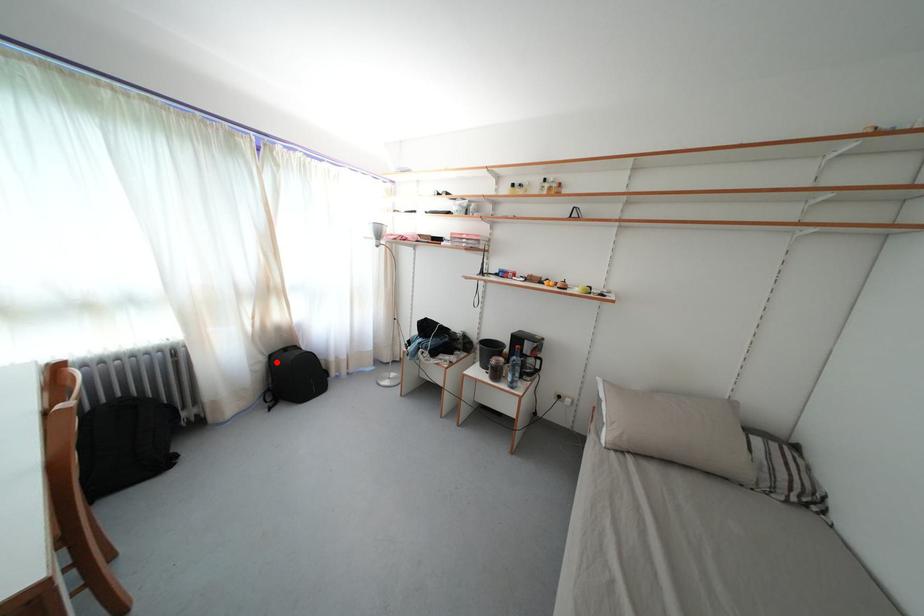
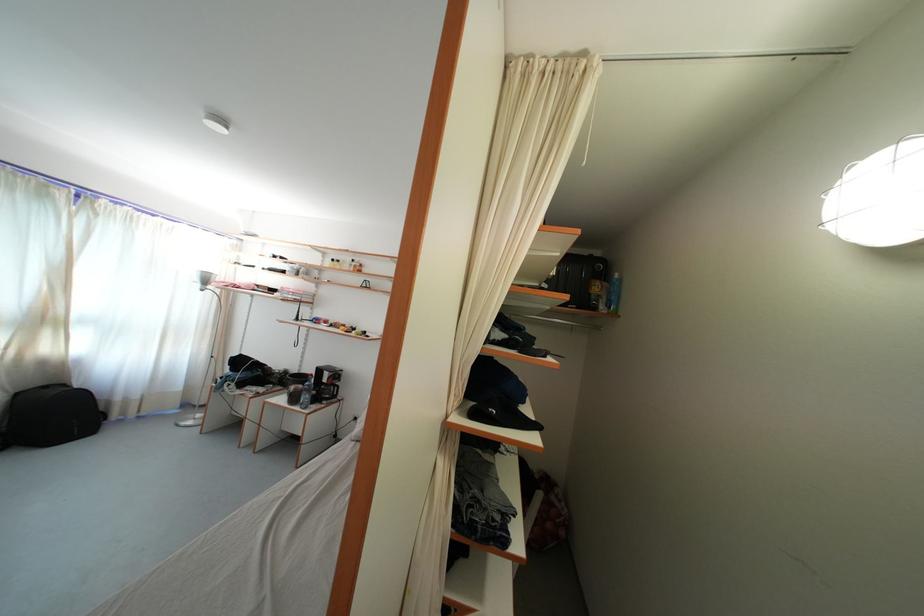
Question: I am providing you with two images of the same scene from different viewpoints. Given a red point in image1, look at the same physical point in image2. Is it:

Choices:
 (A) Closer to the viewpoint
 (B) Farther from the viewpoint

Answer: (B)